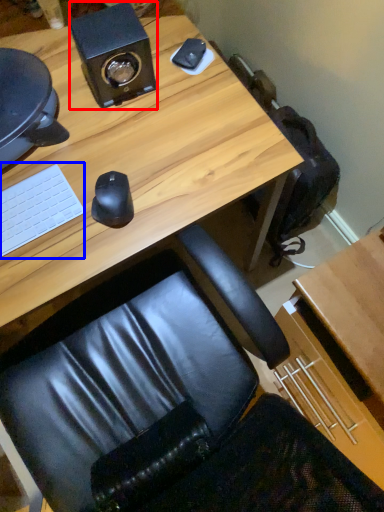
Question: Among these objects, which one is farthest to the camera, speaker (highlighted by a red box) or laptop keyboard (highlighted by a blue box)?

Choices:
 (A) speaker
 (B) laptop keyboard

Answer: (A)